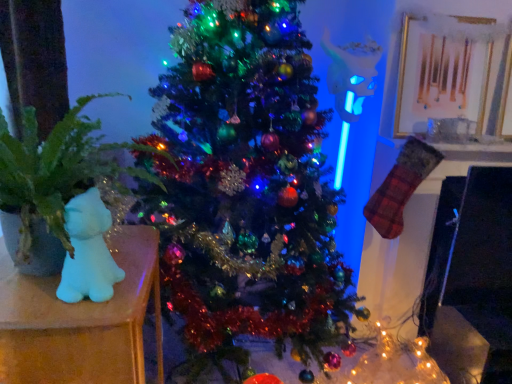
Question: From a real-world perspective, is white matte bear at left on green matte plant at left?

Choices:
 (A) no
 (B) yes

Answer: (A)

Question: From the image's perspective, is white matte bear at left beneath green matte plant at left?

Choices:
 (A) no
 (B) yes

Answer: (B)

Question: Considering the relative positions of white matte bear at left and green matte plant at left in the image provided, is white matte bear at left behind green matte plant at left?

Choices:
 (A) yes
 (B) no

Answer: (A)

Question: Is white matte bear at left positioned beyond the bounds of green matte plant at left?

Choices:
 (A) yes
 (B) no

Answer: (A)

Question: Is white matte bear at left shorter than green matte plant at left?

Choices:
 (A) no
 (B) yes

Answer: (A)

Question: From a real-world perspective, relative to shiny green christmas tree at center, is white matte bear at left vertically above or below?

Choices:
 (A) below
 (B) above

Answer: (A)

Question: Would you say white matte bear at left is to the left or to the right of shiny green christmas tree at center in the picture?

Choices:
 (A) right
 (B) left

Answer: (B)

Question: Considering the positions of white matte bear at left and shiny green christmas tree at center in the image, is white matte bear at left taller or shorter than shiny green christmas tree at center?

Choices:
 (A) tall
 (B) short

Answer: (B)

Question: Is white matte bear at left inside or outside of shiny green christmas tree at center?

Choices:
 (A) inside
 (B) outside

Answer: (B)

Question: Is white matte plush cat at left wider or thinner than shiny green christmas tree at center?

Choices:
 (A) wide
 (B) thin

Answer: (B)

Question: From the image's perspective, is white matte plush cat at left positioned above or below shiny green christmas tree at center?

Choices:
 (A) below
 (B) above

Answer: (A)

Question: In terms of height, does white matte plush cat at left look taller or shorter compared to shiny green christmas tree at center?

Choices:
 (A) short
 (B) tall

Answer: (A)

Question: Considering the positions of white matte plush cat at left and shiny green christmas tree at center in the image, is white matte plush cat at left bigger or smaller than shiny green christmas tree at center?

Choices:
 (A) big
 (B) small

Answer: (B)

Question: In the image, is white matte bear at left positioned in front of or behind green matte plant at left?

Choices:
 (A) behind
 (B) front

Answer: (A)

Question: In terms of height, does white matte bear at left look taller or shorter compared to green matte plant at left?

Choices:
 (A) short
 (B) tall

Answer: (B)